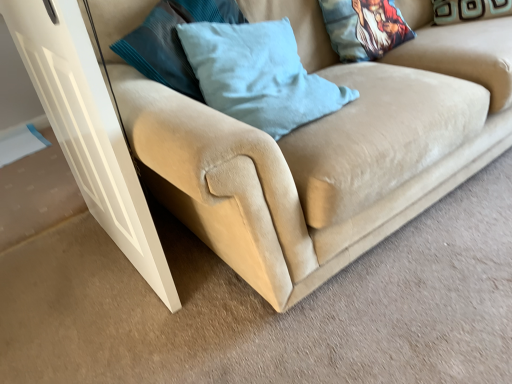
I want to click on teal velvet pillow at upper right, which is the third pillow from left to right, so click(x=469, y=10).

What do you see at coordinates (258, 75) in the screenshot? The image size is (512, 384). I see `light blue fabric pillow at center, arranged as the first pillow when viewed from the left` at bounding box center [258, 75].

Measure the distance between point [367,8] and camera.

Point [367,8] is 5.59 feet from camera.

Locate an element on the screen. teal velvet pillow at upper right, which is the third pillow from left to right is located at coordinates (469, 10).

From the image's perspective, which is below, teal velvet pillow at upper right, marked as the first pillow in a right-to-left arrangement, or white glossy door at lower left?

From the image's view, white glossy door at lower left is below.

Between teal velvet pillow at upper right, which is the third pillow from left to right, and white glossy door at lower left, which one has larger size?

Bigger between the two is white glossy door at lower left.

Could you measure the distance between teal velvet pillow at upper right, which is the third pillow from left to right, and white glossy door at lower left?

A distance of 1.64 meters exists between teal velvet pillow at upper right, which is the third pillow from left to right, and white glossy door at lower left.

Is teal velvet pillow at upper right, marked as the first pillow in a right-to-left arrangement, shorter than white glossy door at lower left?

Yes.

From the image's perspective, which one is positioned lower, white glossy door at lower left or light blue fabric pillow at center, arranged as the first pillow when viewed from the left?

white glossy door at lower left appears lower in the image.

Is white glossy door at lower left wider or thinner than light blue fabric pillow at center, the third pillow when ordered from right to left?

Considering their sizes, white glossy door at lower left looks slimmer than light blue fabric pillow at center, the third pillow when ordered from right to left.

From a real-world perspective, is white glossy door at lower left physically located above or below light blue fabric pillow at center, arranged as the first pillow when viewed from the left?

From a real-world perspective, white glossy door at lower left is physically below light blue fabric pillow at center, arranged as the first pillow when viewed from the left.

Does point (48, 106) come behind point (238, 52)?

Yes, it is.

Is beige suede couch at lower left shorter than light blue fabric pillow at center, arranged as the first pillow when viewed from the left?

A: No, beige suede couch at lower left is not shorter than light blue fabric pillow at center, arranged as the first pillow when viewed from the left.

Is beige suede couch at lower left turned away from light blue fabric pillow at center, the third pillow when ordered from right to left?

Yes, beige suede couch at lower left is facing away from light blue fabric pillow at center, the third pillow when ordered from right to left.

Is beige suede couch at lower left closer to the viewer compared to light blue fabric pillow at center, arranged as the first pillow when viewed from the left?

Yes, beige suede couch at lower left is in front of light blue fabric pillow at center, arranged as the first pillow when viewed from the left.

Are beige suede couch at lower left and printed fabric pillow at upper right, the 2th pillow viewed from the right, far apart?

beige suede couch at lower left is actually quite close to printed fabric pillow at upper right, the 2th pillow viewed from the right.

From a real-world perspective, which pillow is the 2nd one above the beige suede couch at lower left? Please provide its 2D coordinates.

[(364, 28)]

Does beige suede couch at lower left turn towards printed fabric pillow at upper right, the 2th pillow from the left?

Yes, beige suede couch at lower left is oriented towards printed fabric pillow at upper right, the 2th pillow from the left.

From the image's perspective, which one is positioned higher, teal velvet pillow at upper right, which is the third pillow from left to right, or printed fabric pillow at upper right, the 2th pillow from the left?

From the image's view, teal velvet pillow at upper right, which is the third pillow from left to right, is above.

Considering the relative positions of teal velvet pillow at upper right, marked as the first pillow in a right-to-left arrangement, and printed fabric pillow at upper right, the 2th pillow from the left, in the image provided, is teal velvet pillow at upper right, marked as the first pillow in a right-to-left arrangement, to the right of printed fabric pillow at upper right, the 2th pillow from the left, from the viewer's perspective?

Correct, you'll find teal velvet pillow at upper right, marked as the first pillow in a right-to-left arrangement, to the right of printed fabric pillow at upper right, the 2th pillow from the left.

Who is taller, teal velvet pillow at upper right, marked as the first pillow in a right-to-left arrangement, or printed fabric pillow at upper right, the 2th pillow viewed from the right?

With more height is printed fabric pillow at upper right, the 2th pillow viewed from the right.

Can you confirm if teal velvet pillow at upper right, marked as the first pillow in a right-to-left arrangement, is thinner than printed fabric pillow at upper right, the 2th pillow viewed from the right?

In fact, teal velvet pillow at upper right, marked as the first pillow in a right-to-left arrangement, might be wider than printed fabric pillow at upper right, the 2th pillow viewed from the right.

In terms of size, does teal velvet pillow at upper right, marked as the first pillow in a right-to-left arrangement, appear bigger or smaller than beige suede couch at lower left?

Considering their sizes, teal velvet pillow at upper right, marked as the first pillow in a right-to-left arrangement, takes up less space than beige suede couch at lower left.

Is teal velvet pillow at upper right, which is the third pillow from left to right, far from beige suede couch at lower left?

teal velvet pillow at upper right, which is the third pillow from left to right, is near beige suede couch at lower left, not far away.

Considering their positions, is teal velvet pillow at upper right, which is the third pillow from left to right, located in front of or behind beige suede couch at lower left?

teal velvet pillow at upper right, which is the third pillow from left to right, is behind beige suede couch at lower left.

From a real-world perspective, between teal velvet pillow at upper right, which is the third pillow from left to right, and beige suede couch at lower left, who is vertically higher?

teal velvet pillow at upper right, which is the third pillow from left to right, is physically above.

Considering the relative sizes of light blue fabric pillow at center, arranged as the first pillow when viewed from the left, and white glossy door at lower left in the image provided, is light blue fabric pillow at center, arranged as the first pillow when viewed from the left, wider than white glossy door at lower left?

Yes, light blue fabric pillow at center, arranged as the first pillow when viewed from the left, is wider than white glossy door at lower left.

From the white glossy door at lower left, count 1st pillows backward and point to it. Please provide its 2D coordinates.

[(258, 75)]

From a real-world perspective, which is physically below, light blue fabric pillow at center, the third pillow when ordered from right to left, or white glossy door at lower left?

From a 3D spatial view, white glossy door at lower left is below.

Considering the relative sizes of light blue fabric pillow at center, the third pillow when ordered from right to left, and white glossy door at lower left in the image provided, is light blue fabric pillow at center, the third pillow when ordered from right to left, bigger than white glossy door at lower left?

No, light blue fabric pillow at center, the third pillow when ordered from right to left, is not bigger than white glossy door at lower left.

Where is `pillow that is the 1st object above the white glossy door at lower left (from a real-world perspective)`? Image resolution: width=512 pixels, height=384 pixels. pillow that is the 1st object above the white glossy door at lower left (from a real-world perspective) is located at coordinates (469, 10).

This screenshot has width=512, height=384. I want to click on glass door in front of the light blue fabric pillow at center, the third pillow when ordered from right to left, so click(88, 130).

Estimate the real-world distances between objects in this image. Which object is closer to light blue fabric pillow at center, arranged as the first pillow when viewed from the left, beige suede couch at lower left or printed fabric pillow at upper right, the 2th pillow from the left?

beige suede couch at lower left lies closer to light blue fabric pillow at center, arranged as the first pillow when viewed from the left, than the other object.

Looking at the image, which one is located further to teal velvet pillow at upper right, marked as the first pillow in a right-to-left arrangement, white glossy door at lower left or printed fabric pillow at upper right, the 2th pillow viewed from the right?

Among the two, white glossy door at lower left is located further to teal velvet pillow at upper right, marked as the first pillow in a right-to-left arrangement.

Based on the photo, estimate the real-world distances between objects in this image. Which object is further from light blue fabric pillow at center, the third pillow when ordered from right to left, teal velvet pillow at upper right, marked as the first pillow in a right-to-left arrangement, or white glossy door at lower left?

teal velvet pillow at upper right, marked as the first pillow in a right-to-left arrangement, is positioned further to the anchor light blue fabric pillow at center, the third pillow when ordered from right to left.

When comparing their distances from printed fabric pillow at upper right, the 2th pillow from the left, does beige suede couch at lower left or light blue fabric pillow at center, arranged as the first pillow when viewed from the left, seem further?

light blue fabric pillow at center, arranged as the first pillow when viewed from the left, is further to printed fabric pillow at upper right, the 2th pillow from the left.

From the image, which object appears to be nearer to printed fabric pillow at upper right, the 2th pillow viewed from the right, white glossy door at lower left or light blue fabric pillow at center, the third pillow when ordered from right to left?

light blue fabric pillow at center, the third pillow when ordered from right to left, is closer to printed fabric pillow at upper right, the 2th pillow viewed from the right.

From the image, which object appears to be farther from beige suede couch at lower left, teal velvet pillow at upper right, which is the third pillow from left to right, or white glossy door at lower left?

teal velvet pillow at upper right, which is the third pillow from left to right, lies further to beige suede couch at lower left than the other object.

Which object lies further to the anchor point light blue fabric pillow at center, arranged as the first pillow when viewed from the left, printed fabric pillow at upper right, the 2th pillow viewed from the right, or teal velvet pillow at upper right, which is the third pillow from left to right?

Among the two, teal velvet pillow at upper right, which is the third pillow from left to right, is located further to light blue fabric pillow at center, arranged as the first pillow when viewed from the left.

Based on their spatial positions, is teal velvet pillow at upper right, which is the third pillow from left to right, or light blue fabric pillow at center, the third pillow when ordered from right to left, closer to printed fabric pillow at upper right, the 2th pillow from the left?

teal velvet pillow at upper right, which is the third pillow from left to right, is positioned closer to the anchor printed fabric pillow at upper right, the 2th pillow from the left.

Where is `pillow situated between light blue fabric pillow at center, the third pillow when ordered from right to left, and teal velvet pillow at upper right, which is the third pillow from left to right, from left to right`? The width and height of the screenshot is (512, 384). pillow situated between light blue fabric pillow at center, the third pillow when ordered from right to left, and teal velvet pillow at upper right, which is the third pillow from left to right, from left to right is located at coordinates (364, 28).

Locate an element on the screen. The height and width of the screenshot is (384, 512). pillow located between beige suede couch at lower left and printed fabric pillow at upper right, the 2th pillow from the left, in the depth direction is located at coordinates tap(258, 75).

Locate an element on the screen. This screenshot has width=512, height=384. studio couch between white glossy door at lower left and teal velvet pillow at upper right, which is the third pillow from left to right, from left to right is located at coordinates (312, 146).

Find the location of a particular element. pillow located between white glossy door at lower left and printed fabric pillow at upper right, the 2th pillow from the left, in the left-right direction is located at coordinates (258, 75).